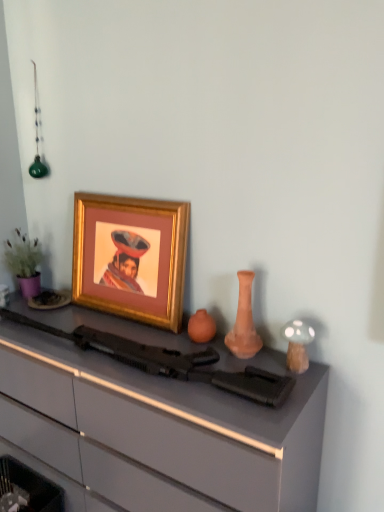
Question: From a real-world perspective, is gold-framed picture at upper left physically above white glossy mushroom at right?

Choices:
 (A) no
 (B) yes

Answer: (B)

Question: Can you confirm if gold-framed picture at upper left is shorter than white glossy mushroom at right?

Choices:
 (A) yes
 (B) no

Answer: (B)

Question: Is gold-framed picture at upper left oriented towards white glossy mushroom at right?

Choices:
 (A) yes
 (B) no

Answer: (B)

Question: From the image's perspective, is gold-framed picture at upper left on white glossy mushroom at right?

Choices:
 (A) yes
 (B) no

Answer: (A)

Question: Considering the relative sizes of gold-framed picture at upper left and white glossy mushroom at right in the image provided, is gold-framed picture at upper left wider than white glossy mushroom at right?

Choices:
 (A) no
 (B) yes

Answer: (B)

Question: Choose the correct answer: Is gold-framed picture at upper left inside matte black rifle at center or outside it?

Choices:
 (A) inside
 (B) outside

Answer: (B)

Question: Is point (188, 205) closer or farther from the camera than point (195, 379)?

Choices:
 (A) farther
 (B) closer

Answer: (A)

Question: From the image's perspective, is gold-framed picture at upper left positioned above or below matte black rifle at center?

Choices:
 (A) above
 (B) below

Answer: (A)

Question: Considering their positions, is gold-framed picture at upper left located in front of or behind matte black rifle at center?

Choices:
 (A) front
 (B) behind

Answer: (B)

Question: From the image's perspective, is gold-framed picture at upper left positioned above or below matte gray desk at center?

Choices:
 (A) above
 (B) below

Answer: (A)

Question: Is gold-framed picture at upper left taller or shorter than matte gray desk at center?

Choices:
 (A) tall
 (B) short

Answer: (B)

Question: Based on their positions, is gold-framed picture at upper left located to the left or right of matte gray desk at center?

Choices:
 (A) left
 (B) right

Answer: (B)

Question: Is gold-framed picture at upper left inside or outside of matte gray desk at center?

Choices:
 (A) inside
 (B) outside

Answer: (B)

Question: Is gold-framed picture at upper left in front of or behind terracotta vase at center in the image?

Choices:
 (A) front
 (B) behind

Answer: (B)

Question: Visually, is gold-framed picture at upper left positioned to the left or to the right of terracotta vase at center?

Choices:
 (A) right
 (B) left

Answer: (B)